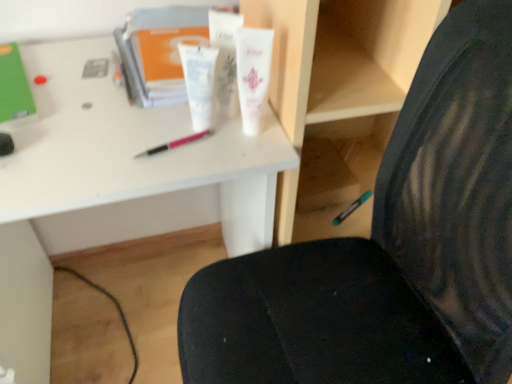
What do you see at coordinates (225, 59) in the screenshot?
I see `white glossy lotion at center, the 2th toiletry from the right` at bounding box center [225, 59].

Find the location of `white matte tube at center, positioned as the first toiletry in right-to-left order`. white matte tube at center, positioned as the first toiletry in right-to-left order is located at coordinates (253, 75).

Measure the distance between point (x=177, y=79) and camera.

Point (x=177, y=79) is 77.00 centimeters away from camera.

At what (x,y) coordinates should I click in order to perform the action: click on white plastic desk at center. Please return your answer as a coordinate pair (x, y). Looking at the image, I should click on (111, 179).

Who is more distant, white glossy lotion at center, which ranks as the 2th toiletry in left-to-right order, or white glossy tube at center, arranged as the 1th toiletry when viewed from the left?

white glossy lotion at center, which ranks as the 2th toiletry in left-to-right order.

Between point (226, 77) and point (190, 106), which one is positioned in front?

The point (226, 77) is closer to the camera.

Which is more to the right, white glossy lotion at center, which ranks as the 2th toiletry in left-to-right order, or white glossy tube at center, positioned as the 3th toiletry in right-to-left order?

Positioned to the right is white glossy lotion at center, which ranks as the 2th toiletry in left-to-right order.

Considering the relative sizes of white glossy lotion at center, the 2th toiletry from the right, and white glossy tube at center, arranged as the 1th toiletry when viewed from the left, in the image provided, is white glossy lotion at center, the 2th toiletry from the right, wider than white glossy tube at center, arranged as the 1th toiletry when viewed from the left,?

Incorrect, the width of white glossy lotion at center, the 2th toiletry from the right, does not surpass that of white glossy tube at center, arranged as the 1th toiletry when viewed from the left.

From a real-world perspective, which is physically above, white plastic desk at center or green matte marker at lower right, which is counted as the first stationery, starting from the back?

green matte marker at lower right, which is counted as the first stationery, starting from the back, from a real-world perspective.

Is white plastic desk at center inside the boundaries of green matte marker at lower right, which is counted as the first stationery, starting from the back, or outside?

white plastic desk at center is located beyond the bounds of green matte marker at lower right, which is counted as the first stationery, starting from the back.

Where is `desk below the green matte marker at lower right, which is the second stationery in left-to-right order (from the image's perspective)`? The height and width of the screenshot is (384, 512). desk below the green matte marker at lower right, which is the second stationery in left-to-right order (from the image's perspective) is located at coordinates (111, 179).

Is white plastic desk at center in front of green matte marker at lower right, which is the second stationery in left-to-right order?

Yes, white plastic desk at center is in front of green matte marker at lower right, which is the second stationery in left-to-right order.

Which object is wider, black mesh chair at center or green matte folder at upper left, which is the second stationery from right to left?

black mesh chair at center is wider.

Which object is positioned more to the left, black mesh chair at center or green matte folder at upper left, the 1th stationery from the left?

green matte folder at upper left, the 1th stationery from the left, is more to the left.

Considering the sizes of objects black mesh chair at center and green matte folder at upper left, positioned as the first stationery in front-to-back order, in the image provided, who is shorter, black mesh chair at center or green matte folder at upper left, positioned as the first stationery in front-to-back order,?

Standing shorter between the two is green matte folder at upper left, positioned as the first stationery in front-to-back order.

Where is `stationery located on the left of black mesh chair at center`? The height and width of the screenshot is (384, 512). stationery located on the left of black mesh chair at center is located at coordinates (14, 86).

How distant is white plastic book at upper center from white glossy tube at center, positioned as the 3th toiletry in right-to-left order?

white plastic book at upper center and white glossy tube at center, positioned as the 3th toiletry in right-to-left order, are 19.39 centimeters apart.

From the image's perspective, starting from the white plastic book at upper center, which toiletry is the 3rd one below? Please provide its 2D coordinates.

[(199, 83)]

Can you confirm if white plastic book at upper center is positioned to the left of white glossy tube at center, arranged as the 1th toiletry when viewed from the left?

Yes, white plastic book at upper center is to the left of white glossy tube at center, arranged as the 1th toiletry when viewed from the left.

From a real-world perspective, is white plastic book at upper center beneath white glossy tube at center, arranged as the 1th toiletry when viewed from the left?

Correct, in the physical world, white plastic book at upper center is lower than white glossy tube at center, arranged as the 1th toiletry when viewed from the left.

Does point (269, 35) come in front of point (154, 152)?

Yes, point (269, 35) is closer to viewer.

Can you confirm if white matte tube at center, positioned as the first toiletry in right-to-left order, is thinner than pink plastic pen at center?

Incorrect, the width of white matte tube at center, positioned as the first toiletry in right-to-left order, is not less than that of pink plastic pen at center.

Is white matte tube at center, the third toiletry viewed from the left, facing towards pink plastic pen at center?

No, white matte tube at center, the third toiletry viewed from the left, is not oriented towards pink plastic pen at center.

Is white matte tube at center, positioned as the first toiletry in right-to-left order, far from pink plastic pen at center?

white matte tube at center, positioned as the first toiletry in right-to-left order, is actually quite close to pink plastic pen at center.

From a real-world perspective, does white plastic desk at center sit lower than white plastic book at upper center?

Yes.

Where is `book that is above the white plastic desk at center (from the image's perspective)`? The image size is (512, 384). book that is above the white plastic desk at center (from the image's perspective) is located at coordinates (158, 51).

Is white plastic desk at center shorter than white plastic book at upper center?

No.

In the scene shown: Considering the sizes of objects green matte folder at upper left, arranged as the first stationery when viewed from the top, and white glossy lotion at center, the 2th toiletry from the right, in the image provided, who is smaller, green matte folder at upper left, arranged as the first stationery when viewed from the top, or white glossy lotion at center, the 2th toiletry from the right,?

white glossy lotion at center, the 2th toiletry from the right.

Is green matte folder at upper left, arranged as the first stationery when viewed from the top, completely or partially outside of white glossy lotion at center, the 2th toiletry from the right?

That's correct, green matte folder at upper left, arranged as the first stationery when viewed from the top, is outside of white glossy lotion at center, the 2th toiletry from the right.

From the image's perspective, is green matte folder at upper left, positioned as the first stationery in front-to-back order, positioned above or below white glossy lotion at center, which ranks as the 2th toiletry in left-to-right order?

green matte folder at upper left, positioned as the first stationery in front-to-back order, is situated lower than white glossy lotion at center, which ranks as the 2th toiletry in left-to-right order, in the image.

Does point (21, 70) appear closer or farther from the camera than point (223, 62)?

Point (21, 70) is farther from the camera than point (223, 62).

From the white glossy lotion at center, the 2th toiletry from the right, count 1st toiletrys forward and point to it. Please provide its 2D coordinates.

[(199, 83)]

Where is `the 1st stationery positioned above the white plastic desk at center (from the image's perspective)`? This screenshot has width=512, height=384. the 1st stationery positioned above the white plastic desk at center (from the image's perspective) is located at coordinates (352, 208).

From the image, which object appears to be nearer to white plastic desk at center, white plastic book at upper center or black mesh chair at center?

white plastic book at upper center lies closer to white plastic desk at center than the other object.

Based on their spatial positions, is green matte marker at lower right, which ranks as the 2th stationery in top-to-bottom order, or black mesh chair at center further from white glossy lotion at center, the 2th toiletry from the right?

Among the two, green matte marker at lower right, which ranks as the 2th stationery in top-to-bottom order, is located further to white glossy lotion at center, the 2th toiletry from the right.

Looking at the image, which one is located closer to green matte marker at lower right, the second stationery in the front-to-back sequence, green matte folder at upper left, which is the second stationery from right to left, or white plastic book at upper center?

The object closer to green matte marker at lower right, the second stationery in the front-to-back sequence, is white plastic book at upper center.

Considering their positions, is green matte folder at upper left, arranged as the 2th stationery when ordered from the bottom, positioned closer to white glossy tube at center, positioned as the 3th toiletry in right-to-left order, than white plastic desk at center?

The object closer to white glossy tube at center, positioned as the 3th toiletry in right-to-left order, is white plastic desk at center.

Based on their spatial positions, is white plastic book at upper center or green matte marker at lower right, which is the first stationery from bottom to top, closer to white glossy tube at center, arranged as the 1th toiletry when viewed from the left?

Among the two, white plastic book at upper center is located nearer to white glossy tube at center, arranged as the 1th toiletry when viewed from the left.

From the picture: When comparing their distances from white matte tube at center, positioned as the first toiletry in right-to-left order, does white glossy tube at center, arranged as the 1th toiletry when viewed from the left, or white glossy lotion at center, which ranks as the 2th toiletry in left-to-right order, seem closer?

The object closer to white matte tube at center, positioned as the first toiletry in right-to-left order, is white glossy lotion at center, which ranks as the 2th toiletry in left-to-right order.

When comparing their distances from white plastic book at upper center, does white glossy lotion at center, the 2th toiletry from the right, or white plastic desk at center seem further?

white glossy lotion at center, the 2th toiletry from the right, lies further to white plastic book at upper center than the other object.

When comparing their distances from green matte folder at upper left, the 1th stationery from the left, does pink plastic pen at center or white plastic book at upper center seem closer?

white plastic book at upper center lies closer to green matte folder at upper left, the 1th stationery from the left, than the other object.

What are the coordinates of `pencil between white plastic desk at center and white glossy tube at center, positioned as the 3th toiletry in right-to-left order, in the horizontal direction` in the screenshot? It's located at click(x=174, y=144).

Find the location of a particular element. pencil between white plastic book at upper center and white plastic desk at center in the up-down direction is located at coordinates [174, 144].

I want to click on book situated between green matte folder at upper left, arranged as the 2th stationery when ordered from the bottom, and pink plastic pen at center from left to right, so click(158, 51).

Find the location of `pencil located between white plastic book at upper center and green matte marker at lower right, which ranks as the 2th stationery in top-to-bottom order, in the left-right direction`. pencil located between white plastic book at upper center and green matte marker at lower right, which ranks as the 2th stationery in top-to-bottom order, in the left-right direction is located at coordinates (174, 144).